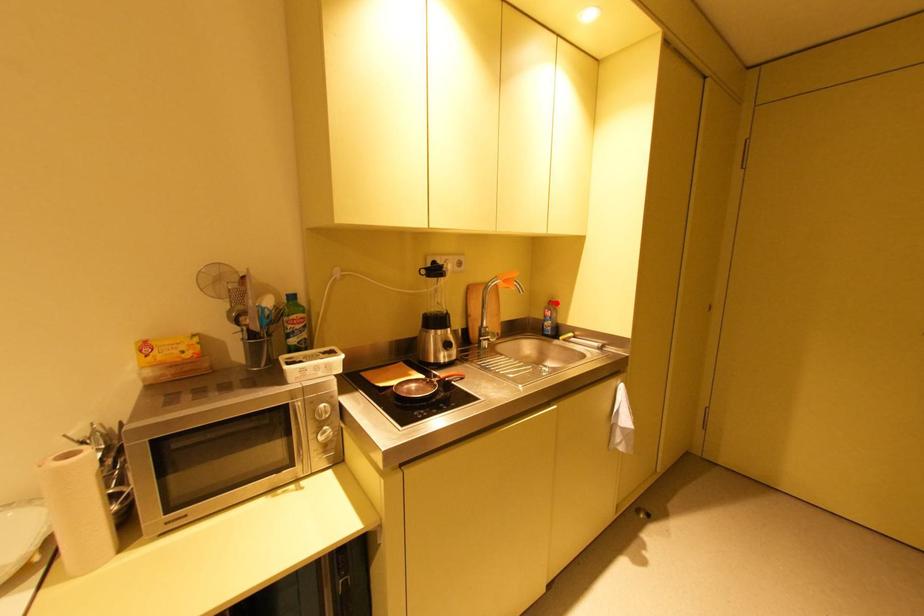
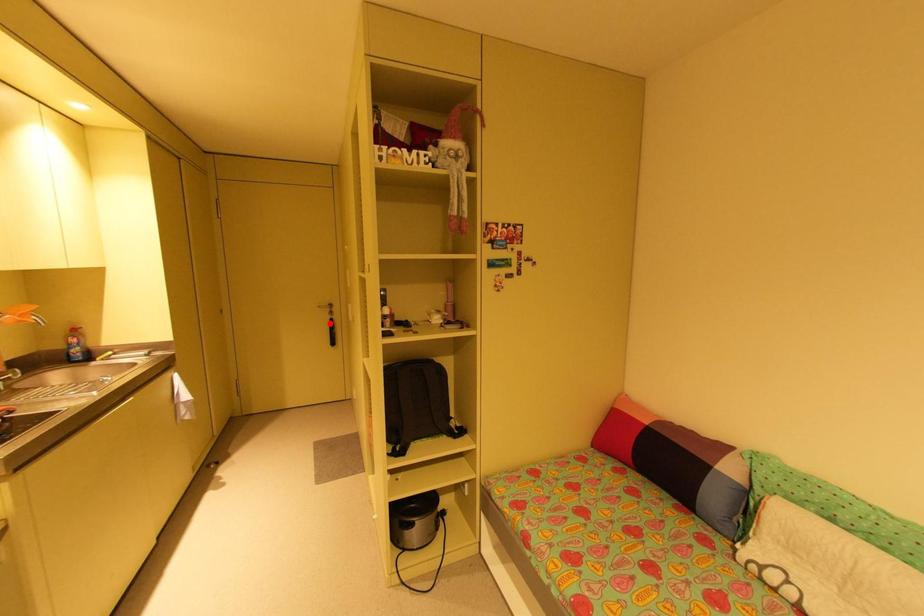
I am providing you with two images of the same scene from different viewpoints. A red point is marked on the first image and another point is marked on the second image. Is the marked point in image1 the same physical position as the marked point in image2?

No